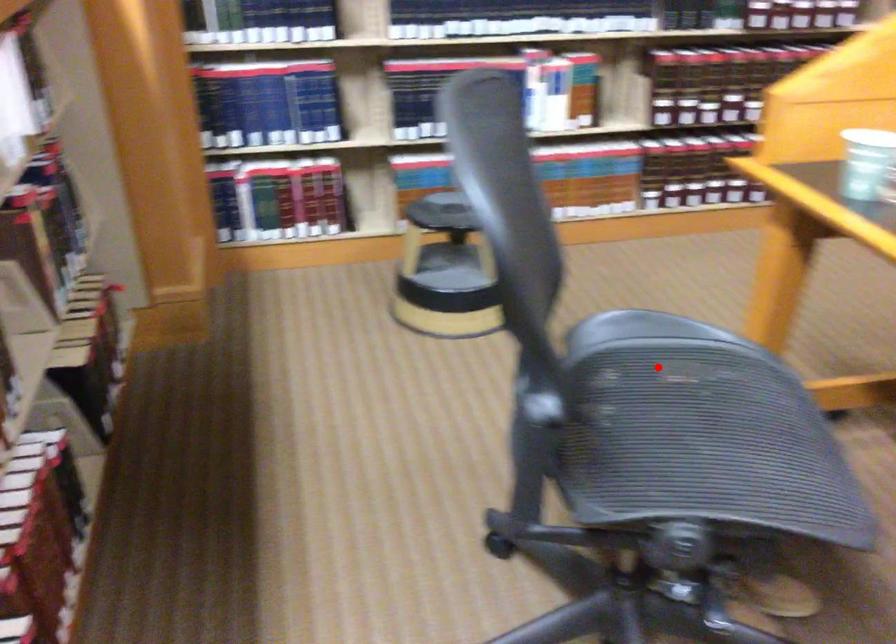
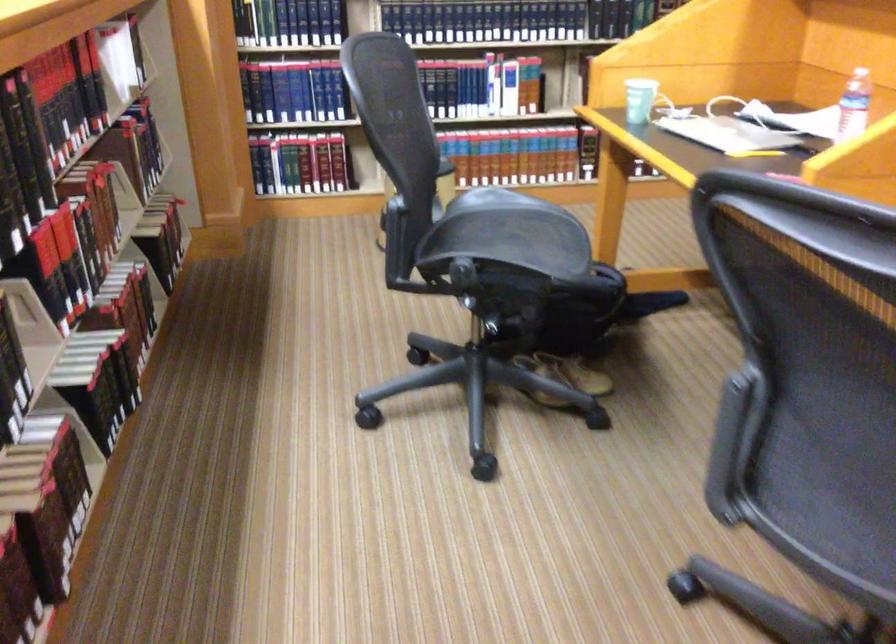
Question: I am providing you with two images of the same scene from different viewpoints. Image1 has a red point marked. In image2, the corresponding 3D location appears at what relative position? Reply with the corresponding letter.

Choices:
 (A) Closer
 (B) Farther

Answer: (B)